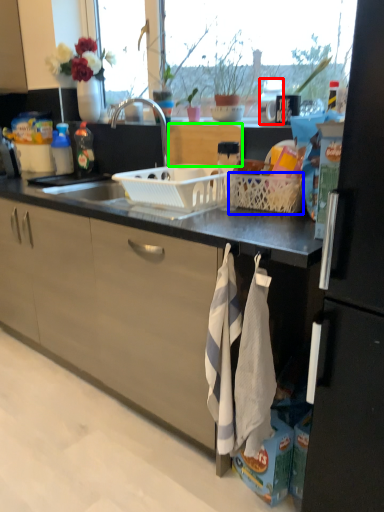
Question: Considering the real-world distances, which object is farthest from appliance (highlighted by a red box)? basket (highlighted by a blue box) or cabinetry (highlighted by a green box)?

Choices:
 (A) basket
 (B) cabinetry

Answer: (A)